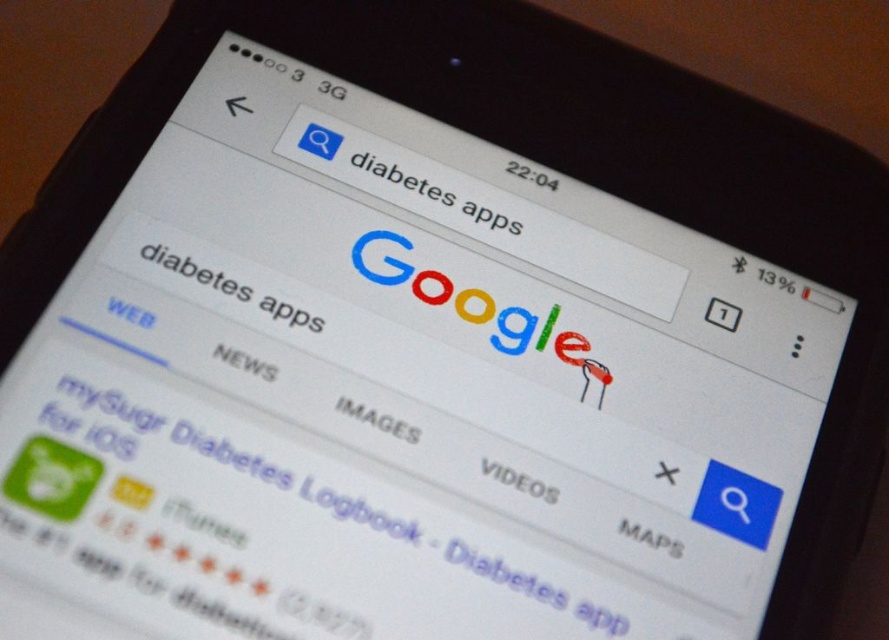
You are holding a smartphone with a screen that has a green glossy app icon at lower left and white text at center. If you want to touch both items without moving your hand, can you reach them with your thumb at the same time? Assume your thumb can cover 16 inches.

The green glossy app icon at lower left and white text at center are 16.93 inches apart, which is slightly more than your thumb can cover. Therefore, you cannot reach both items at the same time with your thumb.

You are holding a smartphone with a cracked screen. You need to tap on one of the two elements visible on the screen to report the crack to the manufacturer. The elements are the green glossy app icon at lower left and the white text at center. Which element should you tap to ensure your tap is registered correctly?

You should tap the green glossy app icon at lower left because it is closer to the viewer than the white text at center, making it more likely to be registered by the touch screen.

You are holding a smartphone with a screen resolution of 1080x2340 pixels. The coordinates given are normalized between 0 and 1. Where is the green glossy app icon at lower left located in pixels? Please provide the coordinates as a tuple of integers rounded to the nearest whole number.

The green glossy app icon at lower left is located at approximately 0.834 x 1080 pixels and 0.336 x 2340 pixels. Calculating this, the x coordinate is 0.834 multiplied by 1080, which equals approximately 903 pixels. The y coordinate is 0.336 multiplied by 2340, resulting in approximately 787 pixels. Therefore, the coordinates are approximately at pixel location of [888,639].